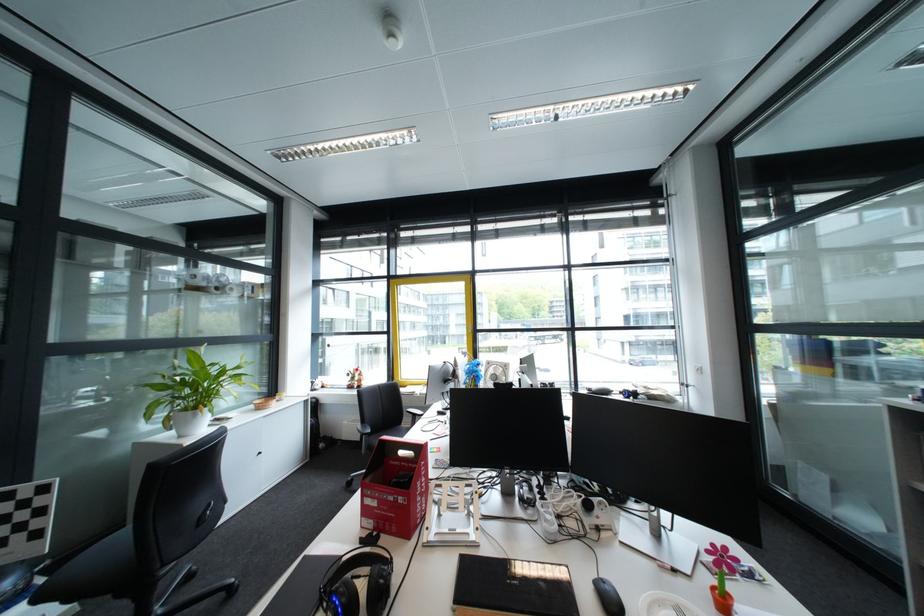
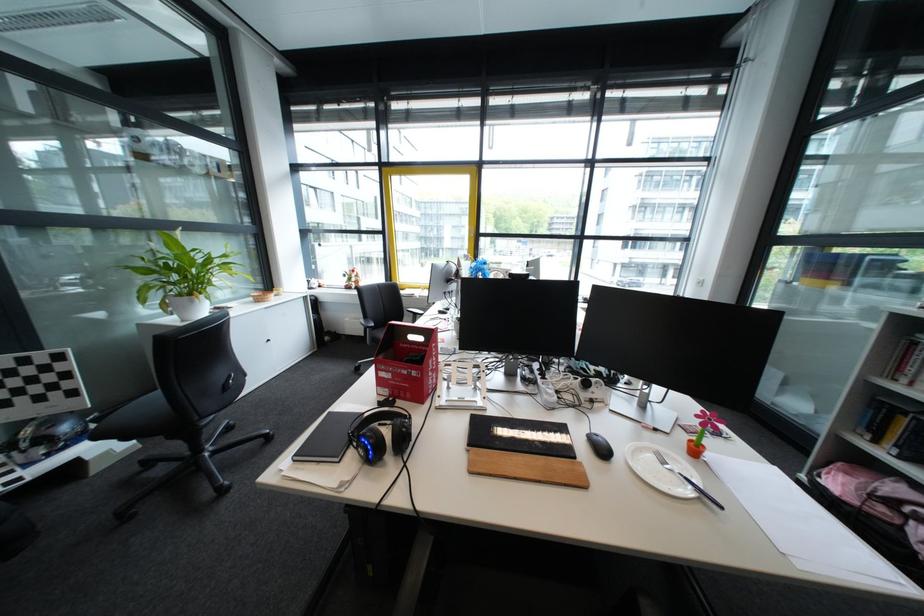
The images are taken continuously from a first-person perspective. In which direction are you moving?

The movement direction of the cameraman is left, forward.